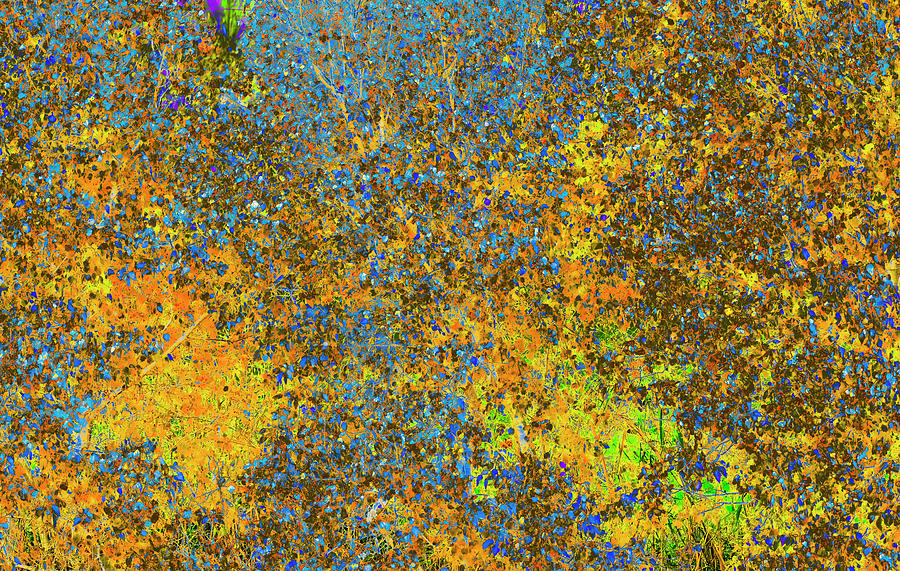
You are a GUI agent. You are given a task and a screenshot of the screen. Output one action in this format:
    pyautogui.click(x=<x>, y=<y>)
    Task: Click on the left side of canopy
    
    Given the screenshot: What is the action you would take?
    pyautogui.click(x=15, y=272)